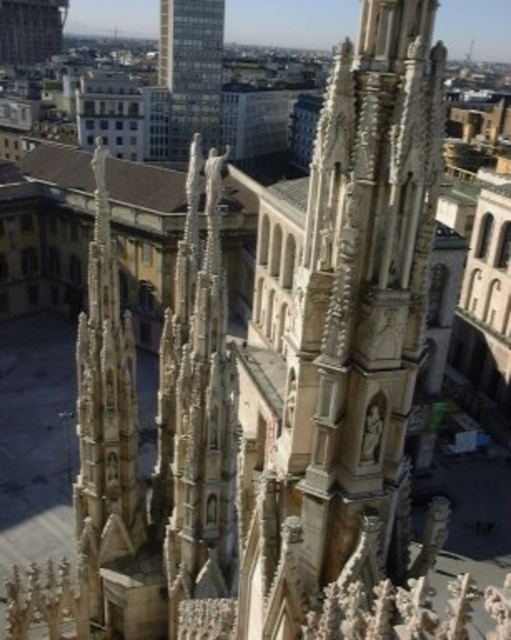
You are a drone operator tasked with flying a drone between the smooth glass skyscraper at upper center and the smooth brown tower at upper left. The drone has a maximum flight distance of 100 meters. Can the drone safely travel between these two structures without exceeding its range?

The smooth glass skyscraper at upper center and smooth brown tower at upper left are 98.25 meters apart, so the drone can safely travel between them as the distance is within its 100 meter range.

You are standing at the base of the cathedral and want to take a photo of the smooth glass skyscraper at upper center. If your camera can focus on objects up to 200 meters away, will it be able to capture the skyscraper clearly?

The smooth glass skyscraper at upper center is 168.62 meters away from the camera. Since the camera can focus up to 200 meters, it will be able to capture the skyscraper clearly.